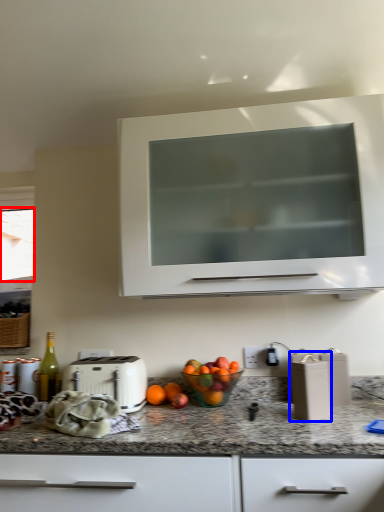
Question: Among these objects, which one is farthest to the camera, window screen (highlighted by a red box) or appliance (highlighted by a blue box)?

Choices:
 (A) window screen
 (B) appliance

Answer: (A)